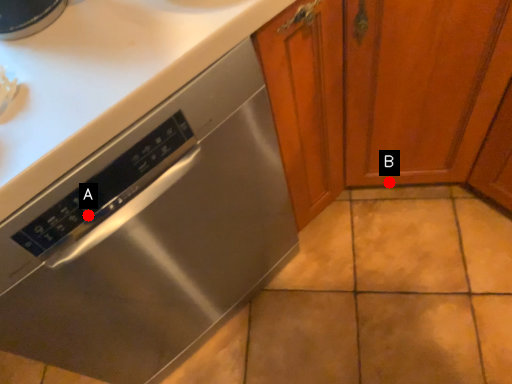
Question: Two points are circled on the image, labeled by A and B beside each circle. Among these points, which one is farthest from the camera?

Choices:
 (A) A is further
 (B) B is further

Answer: (B)